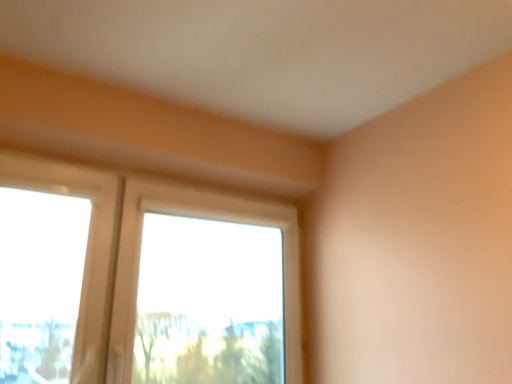
Question: In terms of width, does clear glass window at center look wider or thinner when compared to transparent plastic window screen at left?

Choices:
 (A) wide
 (B) thin

Answer: (A)

Question: Considering the positions of clear glass window at center and transparent plastic window screen at left in the image, is clear glass window at center bigger or smaller than transparent plastic window screen at left?

Choices:
 (A) big
 (B) small

Answer: (A)

Question: Considering their positions, is clear glass window at center located in front of or behind transparent plastic window screen at left?

Choices:
 (A) behind
 (B) front

Answer: (A)

Question: Looking at their shapes, would you say transparent plastic window screen at left is wider or thinner than clear glass window at center?

Choices:
 (A) wide
 (B) thin

Answer: (B)

Question: Is transparent plastic window screen at left inside the boundaries of clear glass window at center, or outside?

Choices:
 (A) outside
 (B) inside

Answer: (A)

Question: From a real-world perspective, relative to clear glass window at center, is transparent plastic window screen at left vertically above or below?

Choices:
 (A) above
 (B) below

Answer: (A)

Question: In terms of height, does transparent plastic window screen at left look taller or shorter compared to clear glass window at center?

Choices:
 (A) short
 (B) tall

Answer: (A)